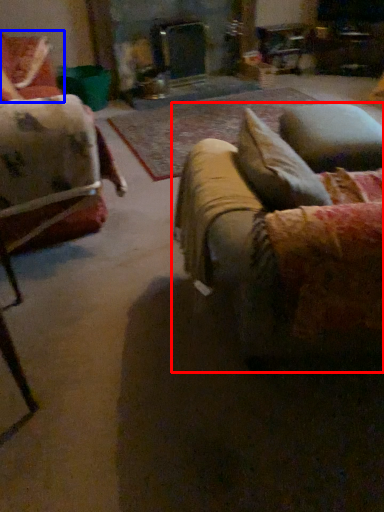
Question: Among these objects, which one is farthest to the camera, studio couch (highlighted by a red box) or chair (highlighted by a blue box)?

Choices:
 (A) studio couch
 (B) chair

Answer: (B)